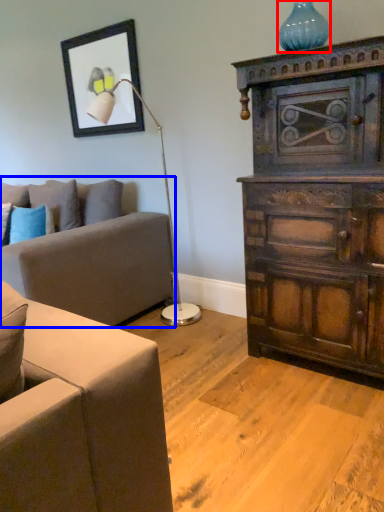
Question: Which of the following is the farthest to the observer, vase (highlighted by a red box) or studio couch (highlighted by a blue box)?

Choices:
 (A) vase
 (B) studio couch

Answer: (A)